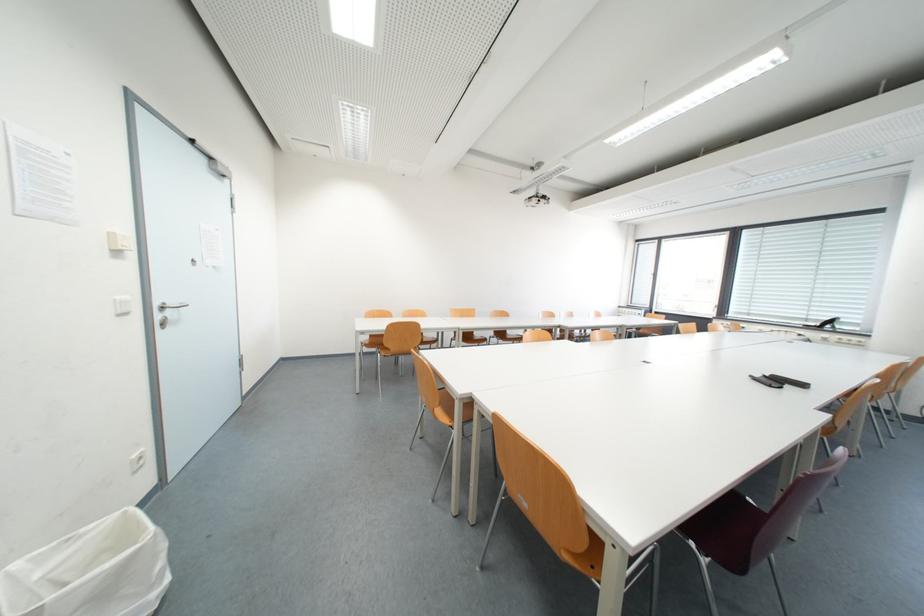
Where would you turn the metal door handle? Please return your answer as a coordinate pair (x, y).

(171, 305)